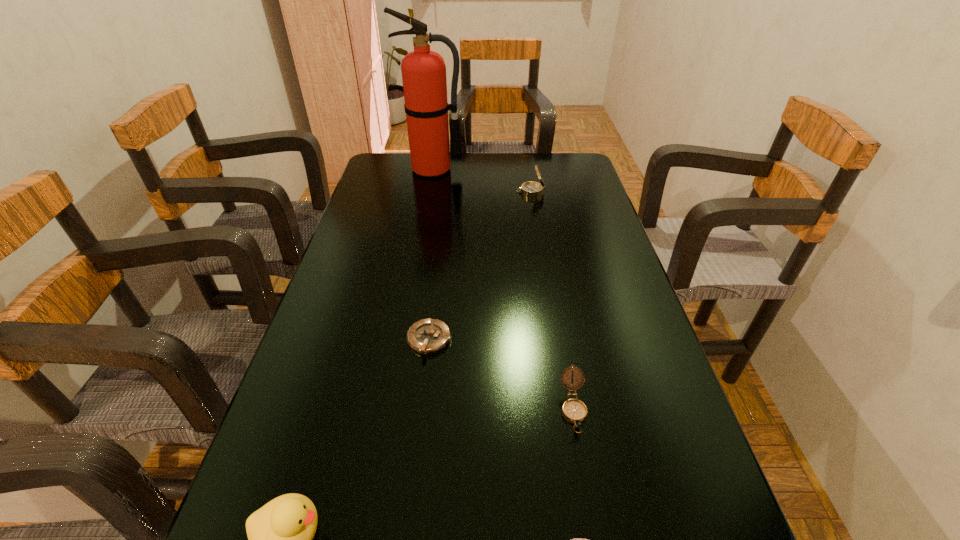
Where is `vacant space located 0.310m with the dial facing the fifth nearest object`? Image resolution: width=960 pixels, height=540 pixels. vacant space located 0.310m with the dial facing the fifth nearest object is located at coordinates (424, 192).

This screenshot has height=540, width=960. I want to click on vacant position located with the dial facing the fifth nearest object, so click(x=430, y=192).

The image size is (960, 540). In order to click on vacant space located 0.120m on the face of the fourth farthest object in this screenshot , I will do `click(590, 503)`.

Where is `vacant space located 0.050m on the left of the shortest object`? The width and height of the screenshot is (960, 540). vacant space located 0.050m on the left of the shortest object is located at coordinates (384, 340).

In order to click on object at the far edge in this screenshot , I will do `click(423, 71)`.

You are a GUI agent. You are given a task and a screenshot of the screen. Output one action in this format:
    pyautogui.click(x=<x>, y=<y>)
    Task: Click on the object positioned at the left edge
    Image resolution: width=960 pixels, height=540 pixels.
    Given the screenshot: What is the action you would take?
    pyautogui.click(x=423, y=71)

At what (x,y) coordinates should I click in order to perform the action: click on object located in the far left corner section of the desktop. Please return your answer as a coordinate pair (x, y). Looking at the image, I should click on (423, 71).

This screenshot has height=540, width=960. Identify the location of free space at the far edge. (502, 158).

Identify the location of free space at the left edge. (356, 421).

You are a GUI agent. You are given a task and a screenshot of the screen. Output one action in this format:
    pyautogui.click(x=<x>, y=<y>)
    Task: Click on the free spot at the right edge of the desktop
    Image resolution: width=960 pixels, height=540 pixels.
    Given the screenshot: What is the action you would take?
    pyautogui.click(x=566, y=200)